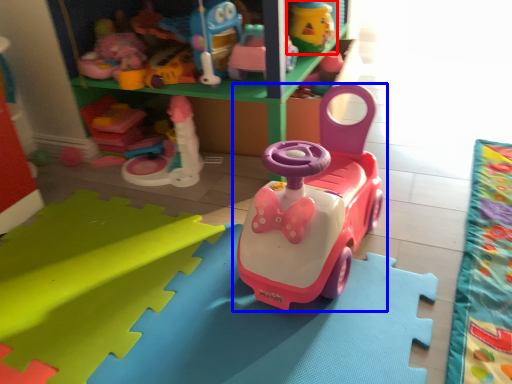
Question: Among these objects, which one is nearest to the camera, toy (highlighted by a red box) or toy (highlighted by a blue box)?

Choices:
 (A) toy
 (B) toy

Answer: (B)